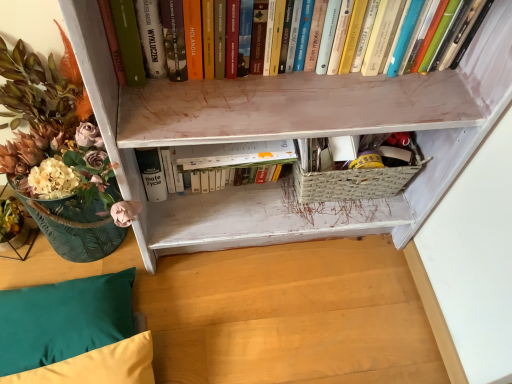
This screenshot has height=384, width=512. In order to click on vacant area located to the right-hand side of translucent glass vase at left in this screenshot , I will do `click(207, 298)`.